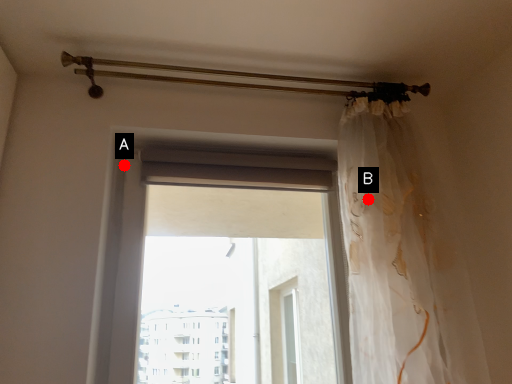
Question: Two points are circled on the image, labeled by A and B beside each circle. Which point appears closest to the camera in this image?

Choices:
 (A) A is closer
 (B) B is closer

Answer: (B)